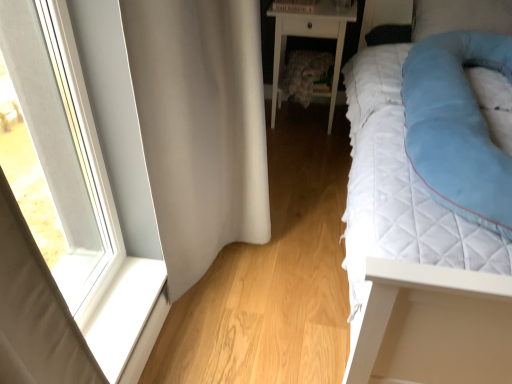
Identify the location of clear glass window at left. (x=68, y=227).

This screenshot has height=384, width=512. Describe the element at coordinates (415, 253) in the screenshot. I see `white quilted bed at right` at that location.

Where is `blue soft pillow at upper right`? Image resolution: width=512 pixels, height=384 pixels. blue soft pillow at upper right is located at coordinates (460, 16).

What do you see at coordinates (460, 16) in the screenshot? I see `blue soft pillow at upper right` at bounding box center [460, 16].

This screenshot has height=384, width=512. Find the location of `light blue quilted pillow at right`. light blue quilted pillow at right is located at coordinates (457, 126).

The width and height of the screenshot is (512, 384). Identify the location of clear glass window at left. (68, 227).

Is clear glass window at left outside of white quilted bed at right?

clear glass window at left is positioned outside white quilted bed at right.

From the image's perspective, is clear glass window at left located above white quilted bed at right?

No, from the image's perspective, clear glass window at left is not on top of white quilted bed at right.

Is point (145, 284) farther from viewer compared to point (377, 101)?

That is False.

The image size is (512, 384). What are the coordinates of `window behind the white quilted bed at right` in the screenshot? It's located at (68, 227).

Considering the sizes of objects blue soft pillow at upper right and light blue quilted pillow at right in the image provided, who is wider, blue soft pillow at upper right or light blue quilted pillow at right?

light blue quilted pillow at right.

Can you confirm if blue soft pillow at upper right is taller than light blue quilted pillow at right?

Yes, blue soft pillow at upper right is taller than light blue quilted pillow at right.

From the image's perspective, which is below, blue soft pillow at upper right or light blue quilted pillow at right?

light blue quilted pillow at right is shown below in the image.

Identify the location of pillow above the light blue quilted pillow at right (from a real-world perspective). (460, 16).

Identify the location of nightstand that is on the right side of clear glass window at left. (310, 37).

Can you confirm if clear glass window at left is wider than white glossy nightstand at center?

No.

Based on the photo, which object is more forward, clear glass window at left or white glossy nightstand at center?

Positioned in front is clear glass window at left.

Which object is positioned more to the left, clear glass window at left or white glossy nightstand at center?

clear glass window at left.

Considering the relative sizes of blue soft pillow at upper right and white smooth window sill at lower left in the image provided, is blue soft pillow at upper right taller than white smooth window sill at lower left?

Yes.

In the scene shown: How different are the orientations of blue soft pillow at upper right and white smooth window sill at lower left in degrees?

The angle between the facing direction of blue soft pillow at upper right and the facing direction of white smooth window sill at lower left is 86.8 degrees.

The image size is (512, 384). Find the location of `pillow above the white smooth window sill at lower left (from the image's perspective)`. pillow above the white smooth window sill at lower left (from the image's perspective) is located at coordinates (460, 16).

Considering their positions, is blue soft pillow at upper right located in front of or behind white smooth window sill at lower left?

blue soft pillow at upper right is behind white smooth window sill at lower left.

Who is taller, white fabric curtain at left or blue soft pillow at upper right?

With more height is white fabric curtain at left.

Is white fabric curtain at left positioned far away from blue soft pillow at upper right?

Yes.

What's the angular difference between white fabric curtain at left and blue soft pillow at upper right's facing directions?

white fabric curtain at left and blue soft pillow at upper right are facing 86.9 degrees away from each other.

From a real-world perspective, is white fabric curtain at left physically above blue soft pillow at upper right?

Incorrect, from a real-world perspective, white fabric curtain at left is lower than blue soft pillow at upper right.

Relative to light blue quilted pillow at right, is white glossy nightstand at center in front or behind?

Clearly, white glossy nightstand at center is behind light blue quilted pillow at right.

There is a white glossy nightstand at center. Where is `cat bed above it (from a real-world perspective)`? The image size is (512, 384). cat bed above it (from a real-world perspective) is located at coordinates (457, 126).

From a real-world perspective, is white glossy nightstand at center located higher than light blue quilted pillow at right?

Incorrect, from a real-world perspective, white glossy nightstand at center is lower than light blue quilted pillow at right.

Choose the correct answer: Is white glossy nightstand at center inside light blue quilted pillow at right or outside it?

white glossy nightstand at center is not enclosed by light blue quilted pillow at right.

Where is `window above the white smooth window sill at lower left (from the image's perspective)`? The height and width of the screenshot is (384, 512). window above the white smooth window sill at lower left (from the image's perspective) is located at coordinates (68, 227).

Based on the photo, is clear glass window at left taller or shorter than white smooth window sill at lower left?

clear glass window at left is taller than white smooth window sill at lower left.

Is there a large distance between clear glass window at left and white smooth window sill at lower left?

No, there isn't a large distance between clear glass window at left and white smooth window sill at lower left.

From a real-world perspective, is clear glass window at left under white smooth window sill at lower left?

Actually, clear glass window at left is physically above white smooth window sill at lower left in the real world.

Find the location of a particular element. The height and width of the screenshot is (384, 512). window below the white quilted bed at right (from the image's perspective) is located at coordinates (68, 227).

Where is `cat bed that is in front of the blue soft pillow at upper right`? cat bed that is in front of the blue soft pillow at upper right is located at coordinates (457, 126).

Considering their positions, is white smooth window sill at lower left positioned further to white glossy nightstand at center than clear glass window at left?

Among the two, white smooth window sill at lower left is located further to white glossy nightstand at center.

When comparing their distances from white quilted bed at right, does white fabric curtain at left or white smooth window sill at lower left seem closer?

Among the two, white fabric curtain at left is located nearer to white quilted bed at right.

Based on the photo, based on their spatial positions, is white fabric curtain at left or light blue quilted pillow at right further from white glossy nightstand at center?

Based on the image, white fabric curtain at left appears to be further to white glossy nightstand at center.

Consider the image. From the image, which object appears to be farther from clear glass window at left, blue soft pillow at upper right or white quilted bed at right?

blue soft pillow at upper right.

Estimate the real-world distances between objects in this image. Which object is further from white smooth window sill at lower left, white glossy nightstand at center or light blue quilted pillow at right?

white glossy nightstand at center.

Which object lies further to the anchor point white fabric curtain at left, white glossy nightstand at center or blue soft pillow at upper right?

blue soft pillow at upper right is positioned further to the anchor white fabric curtain at left.

From the image, which object appears to be farther from blue soft pillow at upper right, light blue quilted pillow at right or white fabric curtain at left?

Among the two, white fabric curtain at left is located further to blue soft pillow at upper right.

Based on the photo, looking at the image, which one is located closer to light blue quilted pillow at right, white fabric curtain at left or blue soft pillow at upper right?

blue soft pillow at upper right.

Where is `pillow located between white quilted bed at right and white glossy nightstand at center in the depth direction`? The image size is (512, 384). pillow located between white quilted bed at right and white glossy nightstand at center in the depth direction is located at coordinates (460, 16).

This screenshot has height=384, width=512. Find the location of `cat bed situated between white fabric curtain at left and blue soft pillow at upper right from left to right`. cat bed situated between white fabric curtain at left and blue soft pillow at upper right from left to right is located at coordinates (457, 126).

Locate an element on the screen. window sill located between clear glass window at left and white quilted bed at right in the left-right direction is located at coordinates (127, 319).

Identify the location of window sill between light blue quilted pillow at right and white glossy nightstand at center in the front-back direction. The image size is (512, 384). (127, 319).